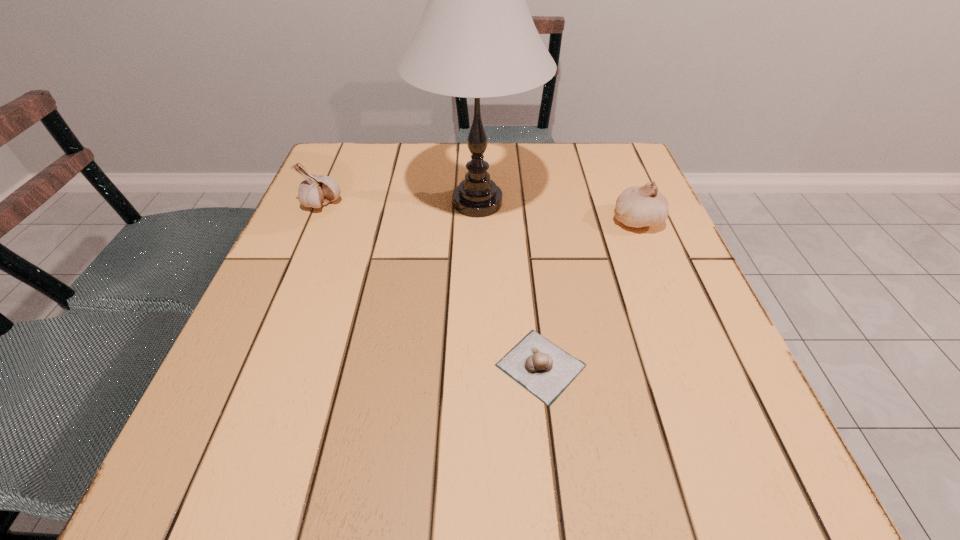
I want to click on the tallest object, so click(x=476, y=39).

You are a GUI agent. You are given a task and a screenshot of the screen. Output one action in this format:
    pyautogui.click(x=<x>, y=<y>)
    Task: Click on the leftmost garlic
    
    Given the screenshot: What is the action you would take?
    pyautogui.click(x=317, y=190)

Locate an element on the screen. the rightmost object is located at coordinates (638, 206).

Identify the location of the shortest object. This screenshot has width=960, height=540. (544, 369).

Identify the location of the second garlic from right to left. (544, 369).

You are a GUI agent. You are given a task and a screenshot of the screen. Output one action in this format:
    pyautogui.click(x=<x>, y=<y>)
    Task: Click on the blank space located 0.070m on the back of the lamp
    
    Given the screenshot: What is the action you would take?
    pyautogui.click(x=478, y=156)

The image size is (960, 540). I want to click on free space located on the front of the leftmost garlic, so click(x=301, y=253).

What are the coordinates of `vacant region located 0.380m on the front of the rightmost garlic` in the screenshot? It's located at (706, 393).

Identify the location of free space located on the back of the nearest garlic. This screenshot has height=540, width=960. (532, 296).

This screenshot has height=540, width=960. Identify the location of lamp present at the far edge. (476, 39).